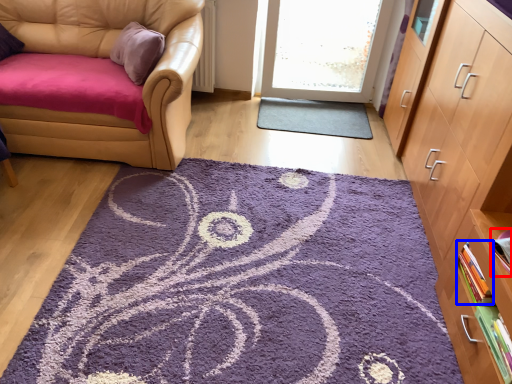
Question: Which object is further to the camera taking this photo, book (highlighted by a red box) or book (highlighted by a blue box)?

Choices:
 (A) book
 (B) book

Answer: (B)